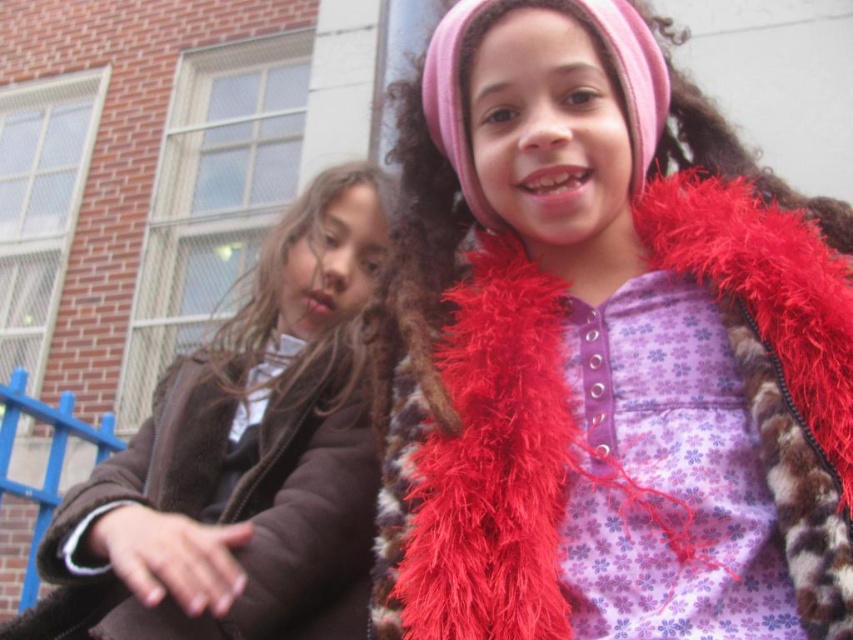
This screenshot has width=853, height=640. Describe the element at coordinates (486, 465) in the screenshot. I see `fuzzy red scarf at upper right` at that location.

From the picture: Can you confirm if fuzzy red scarf at upper right is smaller than brown fuzzy coat at left?

Indeed, fuzzy red scarf at upper right has a smaller size compared to brown fuzzy coat at left.

Which is in front, point (822, 518) or point (99, 557)?

Point (822, 518) is in front.

The height and width of the screenshot is (640, 853). Identify the location of fuzzy red scarf at upper right. (486, 465).